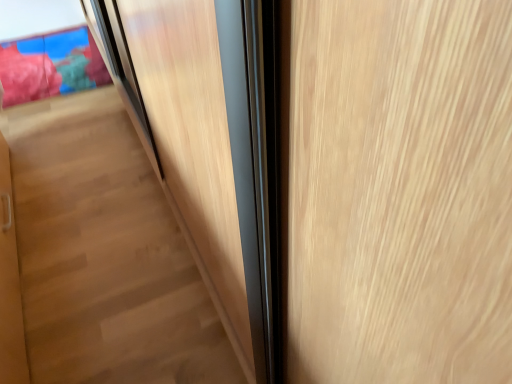
At what (x,y) coordinates should I click in order to perform the action: click on transparent glass window at upper left. Please return your answer as a coordinate pair (x, y). The image size is (512, 384). Looking at the image, I should click on (50, 65).

What do you see at coordinates (50, 65) in the screenshot? This screenshot has height=384, width=512. I see `transparent glass window at upper left` at bounding box center [50, 65].

In order to face transparent glass window at upper left, should I rotate leftwards or rightwards?

To face it directly, rotate left by 25.898 degrees.

This screenshot has width=512, height=384. I want to click on transparent glass window at upper left, so click(50, 65).